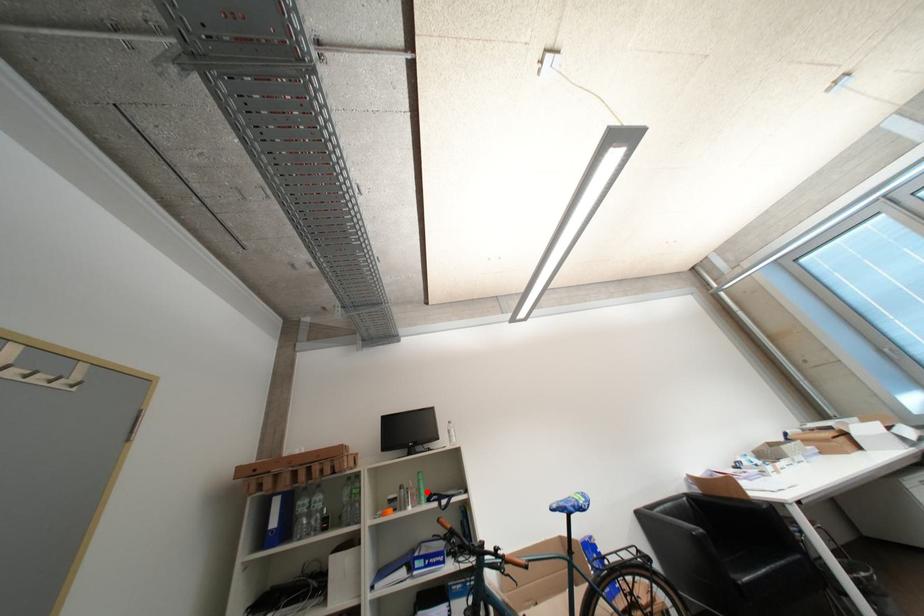
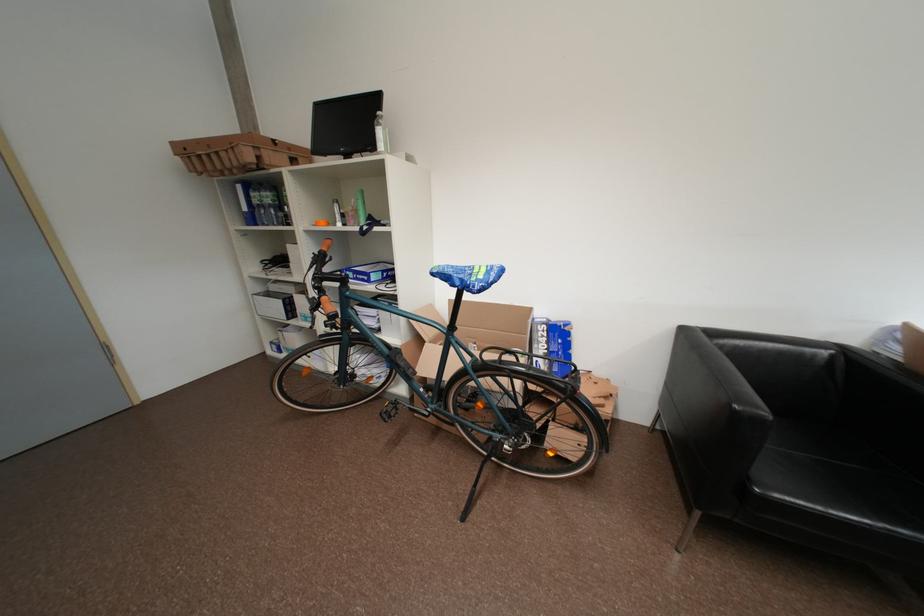
Locate, in the second image, the point that corresponds to the highlighted location in the first image.

(363, 213)